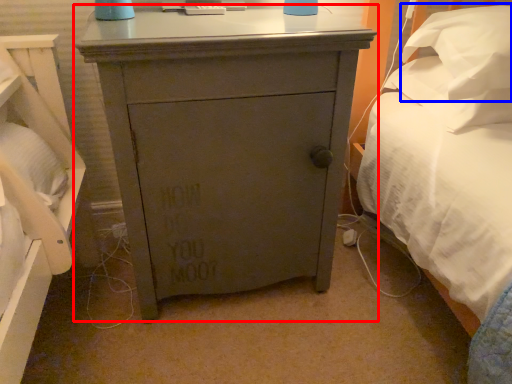
Question: Which of the following is the closest to the observer, chest of drawers (highlighted by a red box) or pillow (highlighted by a blue box)?

Choices:
 (A) chest of drawers
 (B) pillow

Answer: (A)